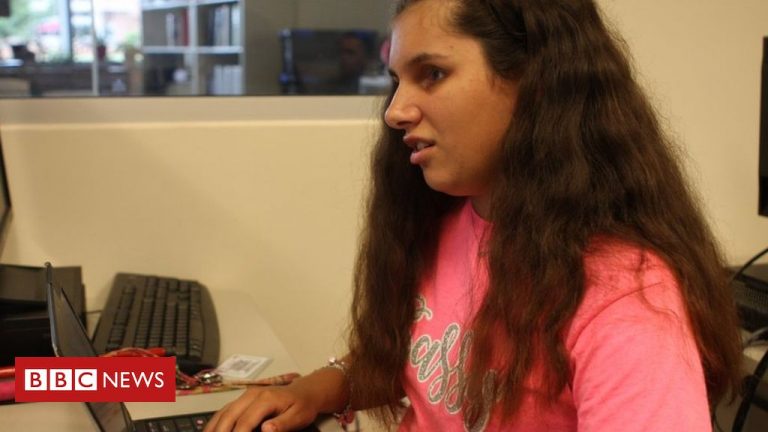
At what (x,y) coordinates should I click in order to perform the action: click on bookcase. Please return your answer as a coordinate pair (x, y). The image size is (768, 432). Looking at the image, I should click on (219, 16).